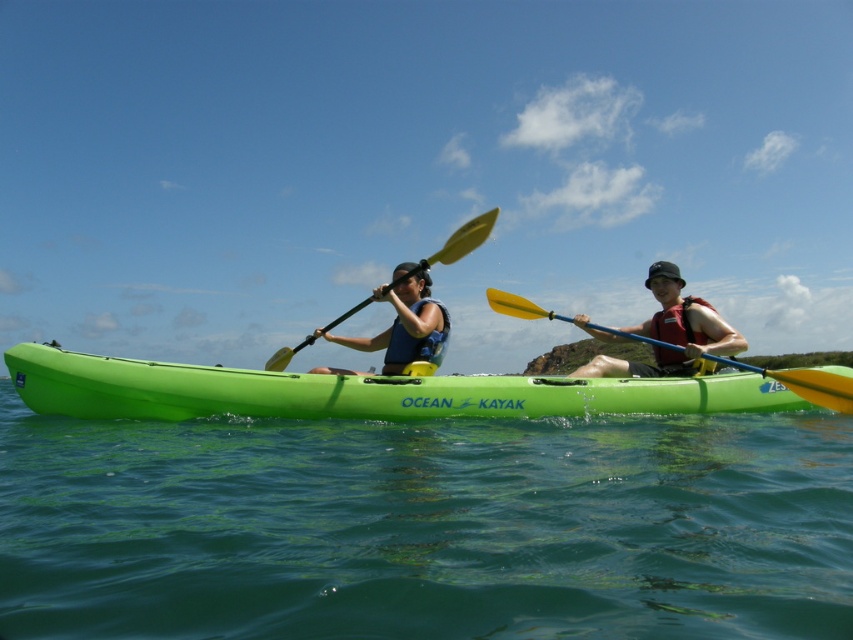
Question: Estimate the real-world distances between objects in this image. Which object is farther from the yellow matte paddle at center?

Choices:
 (A) matte blue life vest at center
 (B) green water at center
 (C) yellow plastic paddle at right
 (D) green plastic kayak at center

Answer: (B)

Question: Does matte blue life vest at center have a larger size compared to yellow plastic paddle at right?

Choices:
 (A) no
 (B) yes

Answer: (A)

Question: Is green water at center wider than blue life vest at center?

Choices:
 (A) no
 (B) yes

Answer: (A)

Question: Can you confirm if green water at center is positioned above yellow matte paddle at center?

Choices:
 (A) yes
 (B) no

Answer: (B)

Question: Which object is closer to the camera taking this photo?

Choices:
 (A) matte blue life vest at center
 (B) blue life vest at center

Answer: (B)

Question: Estimate the real-world distances between objects in this image. Which object is farther from the blue life vest at center?

Choices:
 (A) matte blue life vest at center
 (B) yellow matte paddle at center
 (C) green water at center

Answer: (C)